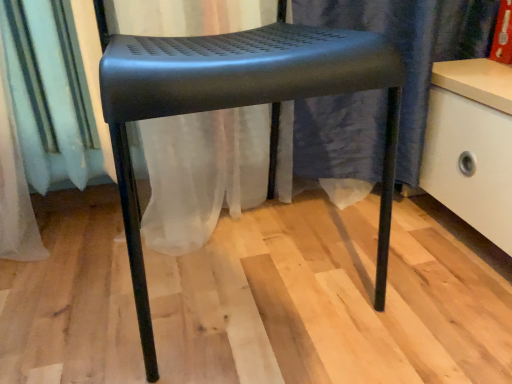
I want to click on vacant area to the right of matte black stool at center, so click(x=405, y=263).